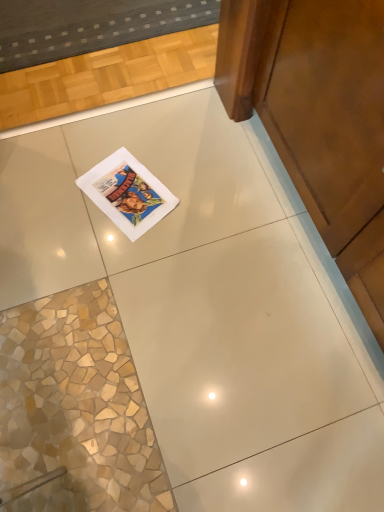
I want to click on free space behind matte paper magazine at center, so click(x=144, y=138).